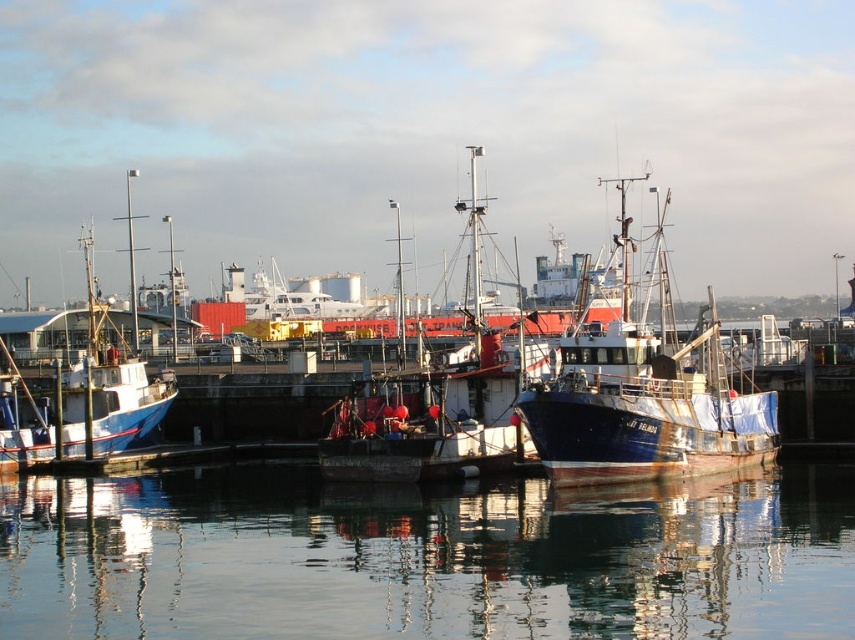
You are standing on the pier and looking at the transparent water at center and the blue matte fishing boat at center. Which object is nearer to you?

The transparent water at center is closer to the viewer than the blue matte fishing boat at center.